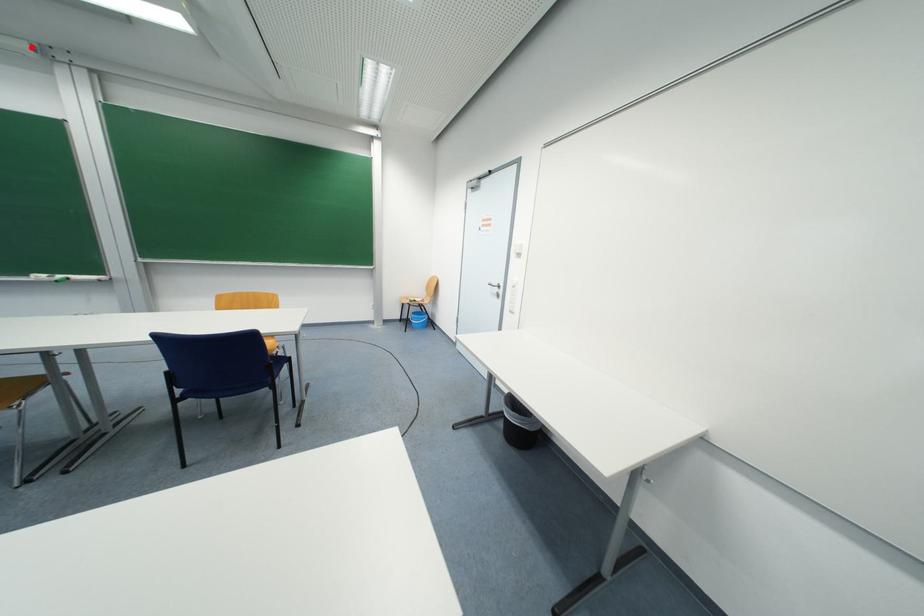
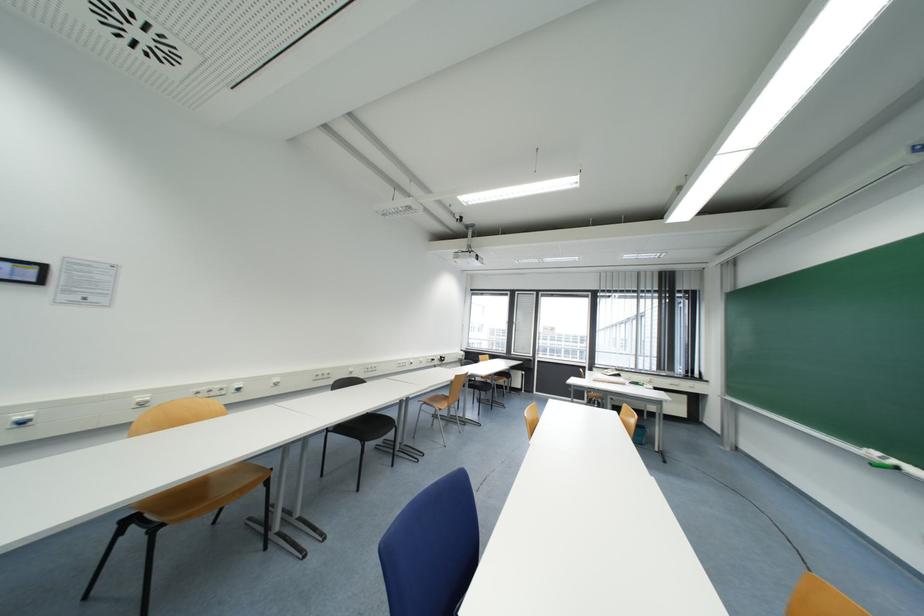
Question: I am providing you with two images of the same scene from different viewpoints. Image1 has a red point marked. In image2, the corresponding 3D location appears at what relative position? Reply with the corresponding letter.

Choices:
 (A) Closer
 (B) Farther

Answer: (A)